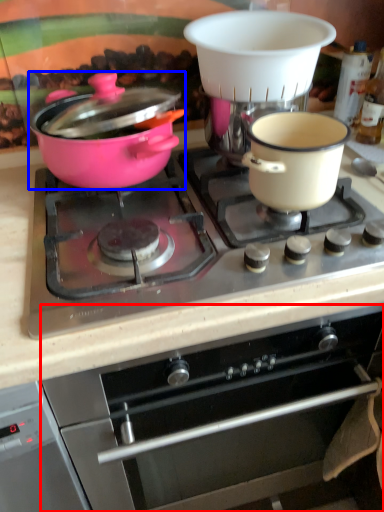
Question: Which of the following is the closest to the observer, oven (highlighted by a red box) or pot/pan (highlighted by a blue box)?

Choices:
 (A) oven
 (B) pot/pan

Answer: (A)